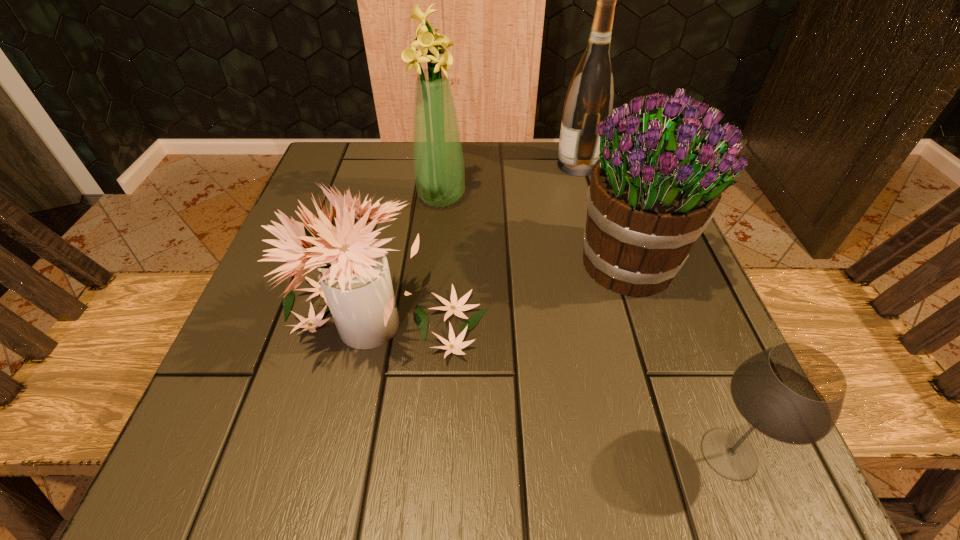
Locate an element on the screen. bouquet that is at the right edge is located at coordinates pyautogui.click(x=653, y=191).

Identify the location of wineglass that is at the right edge. (793, 393).

Locate an element on the screen. The height and width of the screenshot is (540, 960). object that is at the far right corner is located at coordinates (589, 100).

Where is `object that is positioned at the near right corner`? The height and width of the screenshot is (540, 960). object that is positioned at the near right corner is located at coordinates (793, 393).

At what (x,y) coordinates should I click in order to perform the action: click on blank area at the far edge. Please return your answer as a coordinate pair (x, y). Looking at the image, I should click on (535, 166).

The height and width of the screenshot is (540, 960). What are the coordinates of `vacant space at the near edge` in the screenshot? It's located at (567, 434).

Find the location of `vacant region at the left edge`. vacant region at the left edge is located at coordinates (300, 311).

In the image, there is a desktop. Identify the location of vacant space at the right edge. (580, 201).

The height and width of the screenshot is (540, 960). Identify the location of vacant space at the far left corner of the desktop. (376, 165).

Where is `vacant space at the near left corner of the desktop`? vacant space at the near left corner of the desktop is located at coordinates (x=181, y=487).